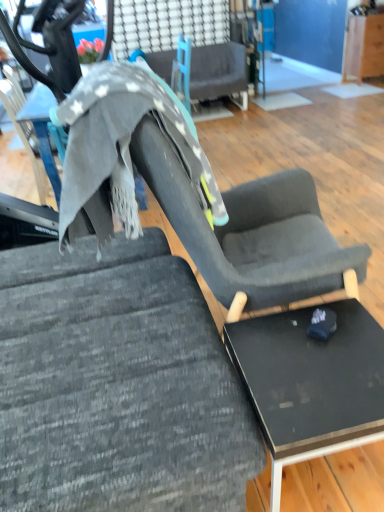
Question: Does textured gray fabric chair at center, marked as the first chair in a top-to-bottom arrangement, appear on the left side of black glossy table at lower right?

Choices:
 (A) no
 (B) yes

Answer: (B)

Question: Can you confirm if textured gray fabric chair at center, marked as the first chair in a top-to-bottom arrangement, is positioned to the right of black glossy table at lower right?

Choices:
 (A) no
 (B) yes

Answer: (A)

Question: Is textured gray fabric chair at center, the 2th chair positioned from the front, facing away from black glossy table at lower right?

Choices:
 (A) yes
 (B) no

Answer: (B)

Question: Can you confirm if textured gray fabric chair at center, marked as the first chair in a top-to-bottom arrangement, is shorter than black glossy table at lower right?

Choices:
 (A) yes
 (B) no

Answer: (B)

Question: Is textured gray fabric chair at center, marked as the first chair in a top-to-bottom arrangement, taller than black glossy table at lower right?

Choices:
 (A) yes
 (B) no

Answer: (A)

Question: Looking at the image, does black glossy table at lower right seem bigger or smaller compared to textured gray fabric at center, the second chair in the top-to-bottom sequence?

Choices:
 (A) big
 (B) small

Answer: (B)

Question: Is black glossy table at lower right to the left or to the right of textured gray fabric at center, placed as the 1th chair when sorted from bottom to top, in the image?

Choices:
 (A) right
 (B) left

Answer: (A)

Question: From the image's perspective, is black glossy table at lower right positioned above or below textured gray fabric at center, which is the 2th chair in back-to-front order?

Choices:
 (A) below
 (B) above

Answer: (A)

Question: Which is correct: black glossy table at lower right is inside textured gray fabric at center, which is the 2th chair in back-to-front order, or outside of it?

Choices:
 (A) inside
 (B) outside

Answer: (B)

Question: Looking at their shapes, would you say textured gray fabric at center, placed as the 1th chair when sorted from bottom to top, is wider or thinner than textured gray fabric chair at center, which appears as the 2th chair when ordered from the bottom?

Choices:
 (A) thin
 (B) wide

Answer: (B)

Question: Considering the positions of textured gray fabric at center, which is the 2th chair in back-to-front order, and textured gray fabric chair at center, marked as the first chair in a top-to-bottom arrangement, in the image, is textured gray fabric at center, which is the 2th chair in back-to-front order, taller or shorter than textured gray fabric chair at center, marked as the first chair in a top-to-bottom arrangement,?

Choices:
 (A) short
 (B) tall

Answer: (B)

Question: Would you say textured gray fabric at center, the second chair in the top-to-bottom sequence, is to the left or to the right of textured gray fabric chair at center, marked as the first chair in a top-to-bottom arrangement, in the picture?

Choices:
 (A) right
 (B) left

Answer: (B)

Question: From the image's perspective, is textured gray fabric at center, the second chair in the top-to-bottom sequence, located above or below textured gray fabric chair at center, marked as the first chair in a top-to-bottom arrangement?

Choices:
 (A) above
 (B) below

Answer: (B)

Question: Relative to black glossy table at lower right, is textured gray fabric chair at center, which appears as the 2th chair when ordered from the bottom, in front or behind?

Choices:
 (A) front
 (B) behind

Answer: (B)

Question: Considering the positions of textured gray fabric chair at center, which is counted as the 1th chair, starting from the back, and black glossy table at lower right in the image, is textured gray fabric chair at center, which is counted as the 1th chair, starting from the back, wider or thinner than black glossy table at lower right?

Choices:
 (A) wide
 (B) thin

Answer: (A)